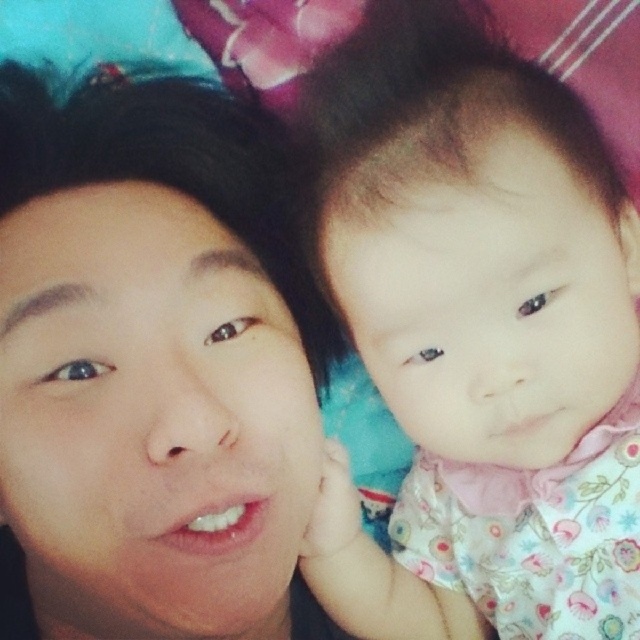
You are a photographer aiming to capture a closeup of the smooth skin face at center without the fluffy pink dress at upper right appearing in the frame. Is this possible given their relative heights?

The fluffy pink dress at upper right is taller than the smooth skin face at center, so positioning the camera to focus solely on the smooth skin face at center while excluding the fluffy pink dress at upper right may be challenging due to its elevated position.

You are a photographer taking a picture of the fluffy pink dress at upper right and the smooth skin face at center. Which object should you focus on first if you want to capture both in the same frame without moving the camera?

The fluffy pink dress at upper right should be focused on first because it is larger in size compared to the smooth skin face at center, ensuring it is properly captured in the frame.